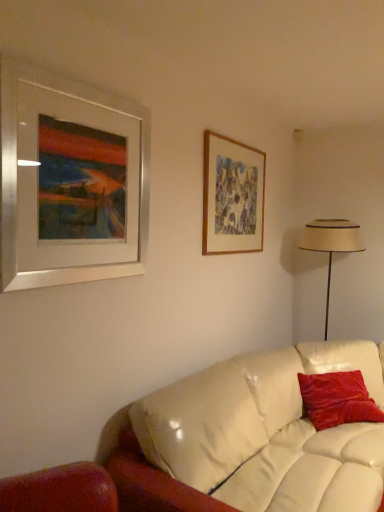
Find the location of a particular element. Image resolution: width=384 pixels, height=512 pixels. wooden picture frame at upper right, placed as the 1th picture frame when sorted from back to front is located at coordinates (232, 196).

Find the location of a particular element. This screenshot has height=512, width=384. velvet red pillow at right is located at coordinates (337, 399).

What is the approximate height of velvet red pillow at right?

The height of velvet red pillow at right is 28.11 centimeters.

Where is `silver metallic picture frame at upper left, arranged as the first picture frame when viewed from the left`? The image size is (384, 512). silver metallic picture frame at upper left, arranged as the first picture frame when viewed from the left is located at coordinates (70, 181).

In order to click on wooden picture frame at upper right, placed as the 1th picture frame when sorted from right to left in this screenshot , I will do `click(232, 196)`.

From the image's perspective, would you say wooden picture frame at upper right, which is counted as the second picture frame, starting from the left, is shown under beige fabric lampshade at right?

No.

How far apart are wooden picture frame at upper right, placed as the 1th picture frame when sorted from back to front, and beige fabric lampshade at right?

31.27 inches.

Considering their positions, is wooden picture frame at upper right, placed as the 1th picture frame when sorted from back to front, located in front of or behind beige fabric lampshade at right?

wooden picture frame at upper right, placed as the 1th picture frame when sorted from back to front, is positioned closer to the viewer than beige fabric lampshade at right.

Which is closer to the camera, (241, 185) or (309, 248)?

The point (241, 185) is closer.

Is wooden picture frame at upper right, placed as the 1th picture frame when sorted from right to left, bigger than silver metallic picture frame at upper left, positioned as the 2th picture frame in back-to-front order?

Incorrect, wooden picture frame at upper right, placed as the 1th picture frame when sorted from right to left, is not larger than silver metallic picture frame at upper left, positioned as the 2th picture frame in back-to-front order.

Does wooden picture frame at upper right, placed as the 1th picture frame when sorted from back to front, appear on the left side of silver metallic picture frame at upper left, the 1th picture frame from the front?

No.

Is wooden picture frame at upper right, which is counted as the second picture frame, starting from the front, not within silver metallic picture frame at upper left, arranged as the first picture frame when viewed from the left?

Indeed, wooden picture frame at upper right, which is counted as the second picture frame, starting from the front, is completely outside silver metallic picture frame at upper left, arranged as the first picture frame when viewed from the left.

Is there a large distance between wooden picture frame at upper right, which is counted as the second picture frame, starting from the front, and silver metallic picture frame at upper left, positioned as the 2th picture frame in back-to-front order?

They are positioned close to each other.

Looking at this image, from a real-world perspective, is beige fabric lampshade at right positioned above or below silver metallic picture frame at upper left, positioned as the 2th picture frame in back-to-front order?

Clearly, from a real-world perspective, beige fabric lampshade at right is below silver metallic picture frame at upper left, positioned as the 2th picture frame in back-to-front order.

Between beige fabric lampshade at right and silver metallic picture frame at upper left, arranged as the first picture frame when viewed from the left, which one appears on the right side from the viewer's perspective?

beige fabric lampshade at right.

In the scene shown: From the image's perspective, is beige fabric lampshade at right on top of silver metallic picture frame at upper left, arranged as the first picture frame when viewed from the left?

Actually, beige fabric lampshade at right appears below silver metallic picture frame at upper left, arranged as the first picture frame when viewed from the left, in the image.

Considering the points (315, 222) and (17, 261), which point is in front, point (315, 222) or point (17, 261)?

The point (17, 261) is in front.

Considering the positions of objects velvet red pillow at right and silver metallic picture frame at upper left, arranged as the first picture frame when viewed from the left, in the image provided, who is more to the right, velvet red pillow at right or silver metallic picture frame at upper left, arranged as the first picture frame when viewed from the left,?

From the viewer's perspective, velvet red pillow at right appears more on the right side.

Which object is thinner, velvet red pillow at right or silver metallic picture frame at upper left, arranged as the first picture frame when viewed from the left?

silver metallic picture frame at upper left, arranged as the first picture frame when viewed from the left, is thinner.

Is point (301, 393) closer to viewer compared to point (1, 191)?

That is False.

Is wooden picture frame at upper right, which is counted as the second picture frame, starting from the front, facing towards velvet red pillow at right?

No, wooden picture frame at upper right, which is counted as the second picture frame, starting from the front, is not oriented towards velvet red pillow at right.

Measure the distance from wooden picture frame at upper right, placed as the 1th picture frame when sorted from back to front, to velvet red pillow at right.

They are 3.92 feet apart.

In terms of width, does wooden picture frame at upper right, placed as the 1th picture frame when sorted from right to left, look wider or thinner when compared to velvet red pillow at right?

In the image, wooden picture frame at upper right, placed as the 1th picture frame when sorted from right to left, appears to be more narrow than velvet red pillow at right.

From a real-world perspective, is beige fabric lampshade at right under wooden picture frame at upper right, placed as the 1th picture frame when sorted from right to left?

Yes.

Is beige fabric lampshade at right to the left of wooden picture frame at upper right, placed as the 1th picture frame when sorted from right to left, from the viewer's perspective?

No, beige fabric lampshade at right is not to the left of wooden picture frame at upper right, placed as the 1th picture frame when sorted from right to left.

Is point (307, 236) more distant than point (258, 196)?

Yes.

Is wooden picture frame at upper right, placed as the 1th picture frame when sorted from right to left, completely or partially inside silver metallic picture frame at upper left, arranged as the first picture frame when viewed from the left?

No, wooden picture frame at upper right, placed as the 1th picture frame when sorted from right to left, is not inside silver metallic picture frame at upper left, arranged as the first picture frame when viewed from the left.

How much distance is there between silver metallic picture frame at upper left, which is the second picture frame in right-to-left order, and wooden picture frame at upper right, which is counted as the second picture frame, starting from the front?

38.85 inches.

Considering the sizes of objects silver metallic picture frame at upper left, which is the second picture frame in right-to-left order, and wooden picture frame at upper right, placed as the 1th picture frame when sorted from back to front, in the image provided, who is bigger, silver metallic picture frame at upper left, which is the second picture frame in right-to-left order, or wooden picture frame at upper right, placed as the 1th picture frame when sorted from back to front,?

With larger size is silver metallic picture frame at upper left, which is the second picture frame in right-to-left order.

Considering the positions of points (76, 185) and (236, 232), is point (76, 185) farther from camera compared to point (236, 232)?

No, (76, 185) is closer to viewer.

Where is `the 2nd picture frame directly above the beige fabric lampshade at right (from a real-world perspective)`? Image resolution: width=384 pixels, height=512 pixels. the 2nd picture frame directly above the beige fabric lampshade at right (from a real-world perspective) is located at coordinates (232, 196).

Where is `picture frame that appears behind the silver metallic picture frame at upper left, which is the second picture frame in right-to-left order`? The image size is (384, 512). picture frame that appears behind the silver metallic picture frame at upper left, which is the second picture frame in right-to-left order is located at coordinates (232, 196).

When comparing their distances from velvet red pillow at right, does silver metallic picture frame at upper left, the 1th picture frame from the front, or beige fabric lampshade at right seem closer?

beige fabric lampshade at right.

Looking at the image, which one is located closer to beige fabric lampshade at right, velvet red pillow at right or wooden picture frame at upper right, placed as the 1th picture frame when sorted from right to left?

Among the two, wooden picture frame at upper right, placed as the 1th picture frame when sorted from right to left, is located nearer to beige fabric lampshade at right.

Consider the image. Which object lies nearer to the anchor point silver metallic picture frame at upper left, arranged as the first picture frame when viewed from the left, wooden picture frame at upper right, which is counted as the second picture frame, starting from the front, or velvet red pillow at right?

wooden picture frame at upper right, which is counted as the second picture frame, starting from the front, is closer to silver metallic picture frame at upper left, arranged as the first picture frame when viewed from the left.

Looking at the image, which one is located closer to wooden picture frame at upper right, which is counted as the second picture frame, starting from the left, velvet red pillow at right or beige fabric lampshade at right?

The object closer to wooden picture frame at upper right, which is counted as the second picture frame, starting from the left, is beige fabric lampshade at right.

Looking at the image, which one is located further to silver metallic picture frame at upper left, positioned as the 2th picture frame in back-to-front order, velvet red pillow at right or beige fabric lampshade at right?

Among the two, beige fabric lampshade at right is located further to silver metallic picture frame at upper left, positioned as the 2th picture frame in back-to-front order.

When comparing their distances from velvet red pillow at right, does beige fabric lampshade at right or silver metallic picture frame at upper left, positioned as the 2th picture frame in back-to-front order, seem further?

Based on the image, silver metallic picture frame at upper left, positioned as the 2th picture frame in back-to-front order, appears to be further to velvet red pillow at right.

Looking at this image, estimate the real-world distances between objects in this image. Which object is further from silver metallic picture frame at upper left, the 1th picture frame from the front, wooden picture frame at upper right, which is counted as the second picture frame, starting from the left, or beige fabric lampshade at right?

Based on the image, beige fabric lampshade at right appears to be further to silver metallic picture frame at upper left, the 1th picture frame from the front.

Estimate the real-world distances between objects in this image. Which object is further from beige fabric lampshade at right, wooden picture frame at upper right, placed as the 1th picture frame when sorted from right to left, or velvet red pillow at right?

velvet red pillow at right lies further to beige fabric lampshade at right than the other object.

Locate an element on the screen. Image resolution: width=384 pixels, height=512 pixels. picture frame between silver metallic picture frame at upper left, positioned as the 2th picture frame in back-to-front order, and beige fabric lampshade at right in the front-back direction is located at coordinates (232, 196).

You are a GUI agent. You are given a task and a screenshot of the screen. Output one action in this format:
    pyautogui.click(x=<x>, y=<y>)
    Task: Click on the pillow between silver metallic picture frame at upper left, positioned as the 2th picture frame in back-to-front order, and beige fabric lampshade at right in the front-back direction
    This screenshot has width=384, height=512.
    Given the screenshot: What is the action you would take?
    pyautogui.click(x=337, y=399)

At what (x,y) coordinates should I click in order to perform the action: click on table lamp between wooden picture frame at upper right, which is counted as the second picture frame, starting from the left, and velvet red pillow at right vertically. Please return your answer as a coordinate pair (x, y). Looking at the image, I should click on (331, 244).

You are a GUI agent. You are given a task and a screenshot of the screen. Output one action in this format:
    pyautogui.click(x=<x>, y=<y>)
    Task: Click on the picture frame between wooden picture frame at upper right, which is counted as the second picture frame, starting from the left, and velvet red pillow at right from top to bottom
    This screenshot has height=512, width=384.
    Given the screenshot: What is the action you would take?
    pyautogui.click(x=70, y=181)